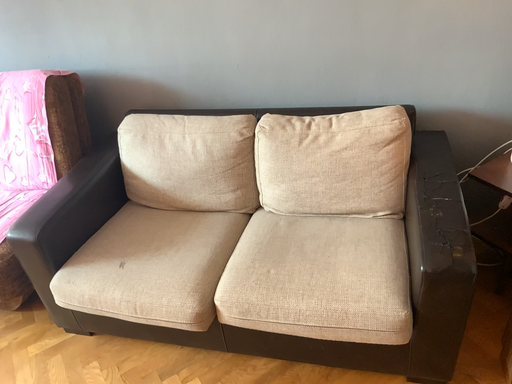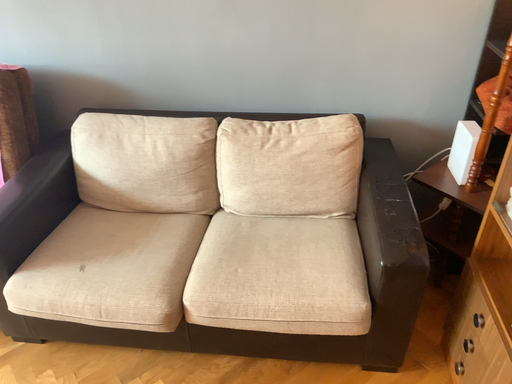
Question: Which way did the camera rotate in the video?

Choices:
 (A) rotated right
 (B) rotated left

Answer: (A)